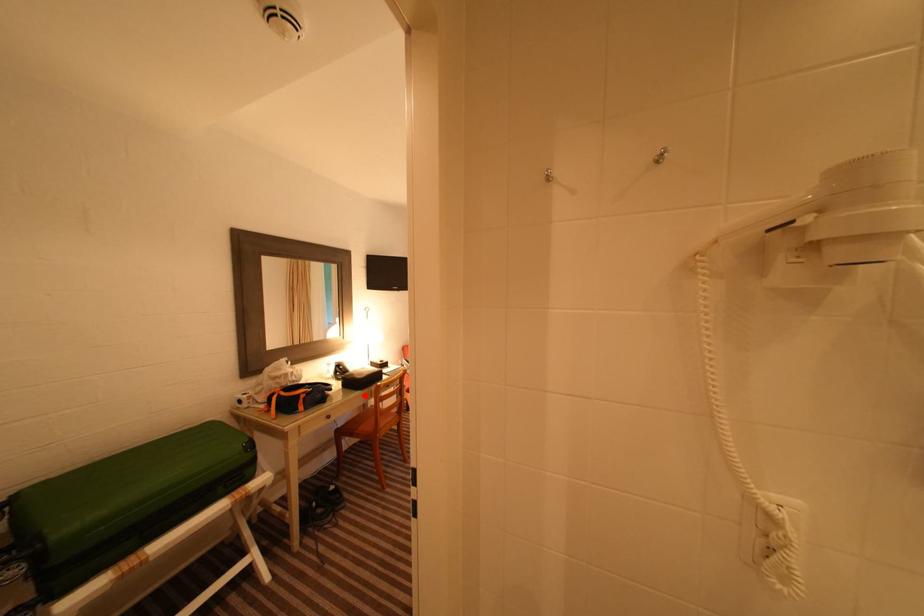
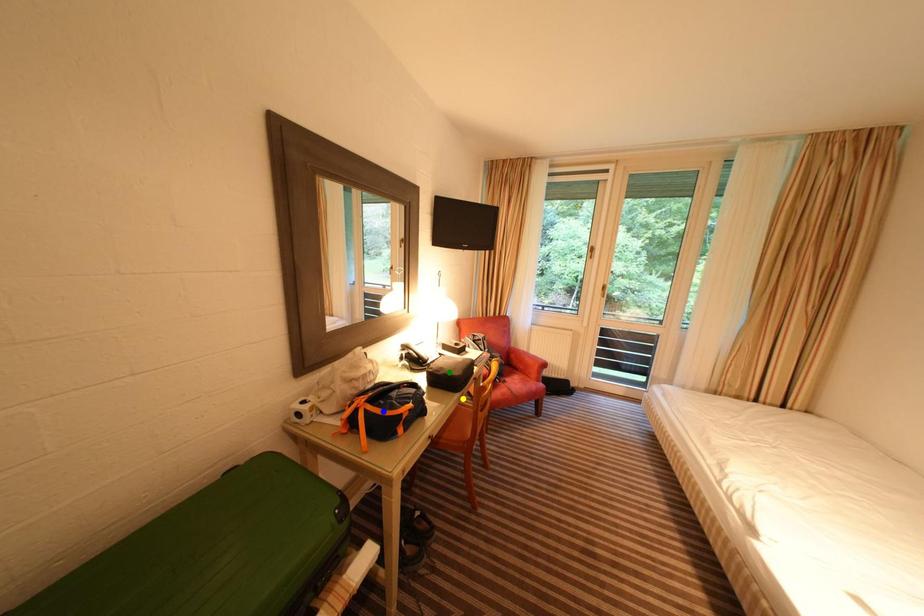
Question: I am providing you with two images of the same scene from different viewpoints. A red point is marked on the first image. You are given multiple points on the second image. In image 2, which mark is for the same physical point as the one in image 1?

Choices:
 (A) yellow point
 (B) blue point
 (C) green point

Answer: (A)